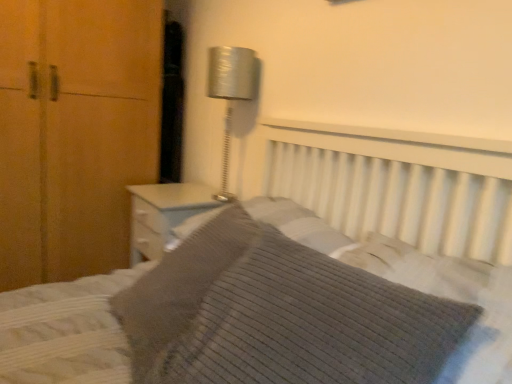
Question: Does knitted fabric bed at center appear on the right side of knitted gray pillow at center, the 2th pillow when ordered from front to back?

Choices:
 (A) yes
 (B) no

Answer: (A)

Question: Is knitted fabric bed at center bigger than knitted gray pillow at center, marked as the 1th pillow in a back-to-front arrangement?

Choices:
 (A) no
 (B) yes

Answer: (B)

Question: Does knitted fabric bed at center have a smaller size compared to knitted gray pillow at center, marked as the 1th pillow in a back-to-front arrangement?

Choices:
 (A) no
 (B) yes

Answer: (A)

Question: Is knitted fabric bed at center not inside knitted gray pillow at center, the 2th pillow when ordered from front to back?

Choices:
 (A) no
 (B) yes

Answer: (B)

Question: Is knitted fabric bed at center placed right next to knitted gray pillow at center, marked as the 1th pillow in a back-to-front arrangement?

Choices:
 (A) yes
 (B) no

Answer: (B)

Question: Considering the relative positions of metallic silver lamp at upper center and ribbed gray pillow at center, acting as the 1th pillow starting from the front, in the image provided, is metallic silver lamp at upper center to the left or to the right of ribbed gray pillow at center, acting as the 1th pillow starting from the front,?

Choices:
 (A) right
 (B) left

Answer: (B)

Question: Considering their positions, is metallic silver lamp at upper center located in front of or behind ribbed gray pillow at center, acting as the 1th pillow starting from the front?

Choices:
 (A) front
 (B) behind

Answer: (B)

Question: Choose the correct answer: Is metallic silver lamp at upper center inside ribbed gray pillow at center, placed as the 2th pillow when sorted from back to front, or outside it?

Choices:
 (A) inside
 (B) outside

Answer: (B)

Question: In terms of size, does metallic silver lamp at upper center appear bigger or smaller than ribbed gray pillow at center, placed as the 2th pillow when sorted from back to front?

Choices:
 (A) small
 (B) big

Answer: (A)

Question: In the image, is ribbed gray pillow at center, placed as the 2th pillow when sorted from back to front, positioned in front of or behind knitted gray pillow at center, marked as the 1th pillow in a back-to-front arrangement?

Choices:
 (A) behind
 (B) front

Answer: (B)

Question: Is ribbed gray pillow at center, acting as the 1th pillow starting from the front, spatially inside knitted gray pillow at center, the 2th pillow when ordered from front to back, or outside of it?

Choices:
 (A) outside
 (B) inside

Answer: (A)

Question: From the image's perspective, relative to knitted gray pillow at center, marked as the 1th pillow in a back-to-front arrangement, is ribbed gray pillow at center, acting as the 1th pillow starting from the front, above or below?

Choices:
 (A) above
 (B) below

Answer: (B)

Question: Is ribbed gray pillow at center, acting as the 1th pillow starting from the front, to the left or to the right of knitted gray pillow at center, marked as the 1th pillow in a back-to-front arrangement, in the image?

Choices:
 (A) right
 (B) left

Answer: (A)

Question: Relative to knitted fabric bed at center, is ribbed gray pillow at center, acting as the 1th pillow starting from the front, in front or behind?

Choices:
 (A) front
 (B) behind

Answer: (B)

Question: From the image's perspective, relative to knitted fabric bed at center, is ribbed gray pillow at center, placed as the 2th pillow when sorted from back to front, above or below?

Choices:
 (A) below
 (B) above

Answer: (B)